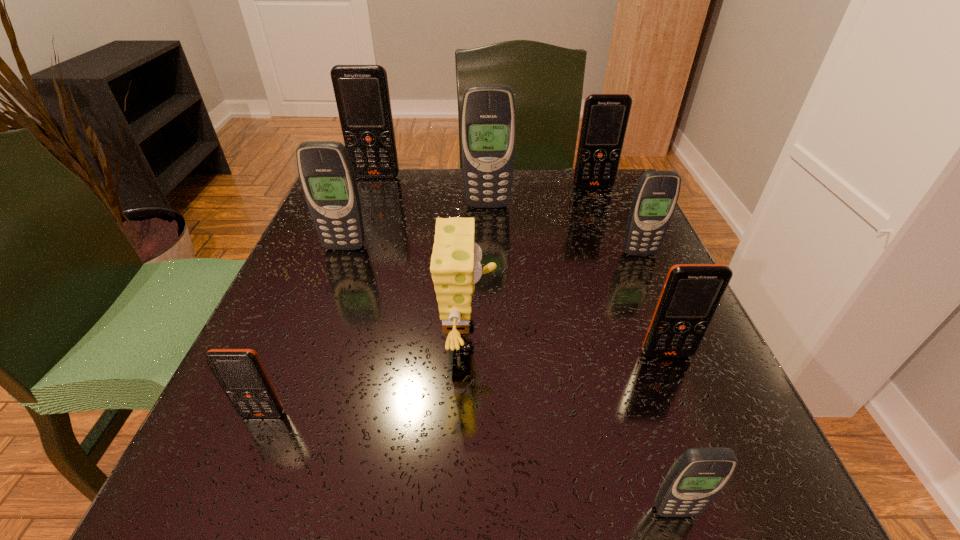
At what (x,y) coordinates should I click in order to perform the action: click on the sixth farthest cellular telephone. Please return your answer as a coordinate pair (x, y). Looking at the image, I should click on (691, 294).

I want to click on the second nearest object, so (x=240, y=372).

The image size is (960, 540). Identify the location of the nearest orange cellular telephone. (240, 372).

I want to click on the nearest cellular telephone, so click(698, 475).

Where is `the smallest gray cellular telephone`? Image resolution: width=960 pixels, height=540 pixels. the smallest gray cellular telephone is located at coordinates (698, 475).

At what (x,y) coordinates should I click in order to perform the action: click on free space located 0.210m on the screen of the farthest object. Please return your answer as a coordinate pair (x, y). This screenshot has width=960, height=540. Looking at the image, I should click on (358, 227).

This screenshot has height=540, width=960. I want to click on vacant space positioned on the screen of the farthest gray cellular telephone, so click(488, 231).

Identify the location of blank space located 0.050m on the screen of the second farthest object. Image resolution: width=960 pixels, height=540 pixels. (598, 200).

In order to click on vacant space located on the screen of the second biggest gray cellular telephone in this screenshot , I will do `click(319, 314)`.

The image size is (960, 540). I want to click on free spot located on the front-facing side of the sponge, so click(611, 338).